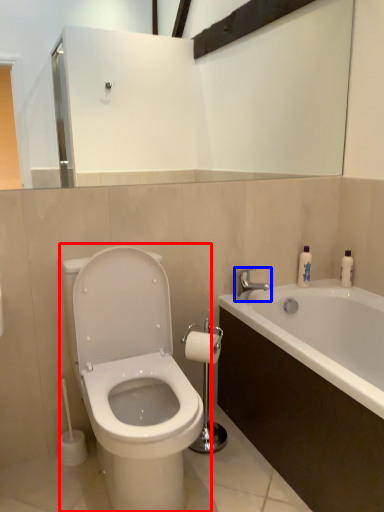
Question: Among these objects, which one is farthest to the camera, toilet (highlighted by a red box) or tap (highlighted by a blue box)?

Choices:
 (A) toilet
 (B) tap

Answer: (B)